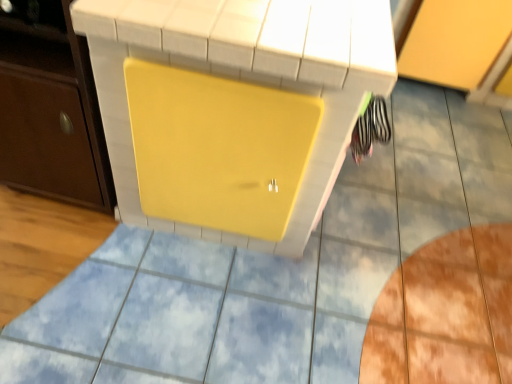
Locate an element on the screen. This screenshot has width=512, height=384. yellow matte cabinet at upper right, which ranks as the first cabinetry in back-to-front order is located at coordinates (455, 41).

Where is `yellow matte vanity at center`? Image resolution: width=512 pixels, height=384 pixels. yellow matte vanity at center is located at coordinates (260, 29).

Identify the location of matte brown cabinet at left, the first cabinetry when ordered from left to right. This screenshot has height=384, width=512. (50, 108).

Is yellow matte cabinet at upper right, placed as the first cabinetry when sorted from right to left, oriented towards matte brown cabinet at left, the first cabinetry when ordered from left to right?

No, yellow matte cabinet at upper right, placed as the first cabinetry when sorted from right to left, is not oriented towards matte brown cabinet at left, the first cabinetry when ordered from left to right.

From the picture: From a real-world perspective, between yellow matte cabinet at upper right, which is the 2th cabinetry in front-to-back order, and matte brown cabinet at left, marked as the second cabinetry in a right-to-left arrangement, who is vertically higher?

From a 3D spatial view, matte brown cabinet at left, marked as the second cabinetry in a right-to-left arrangement, is above.

From the image's perspective, between yellow matte cabinet at upper right, the second cabinetry from the left, and matte brown cabinet at left, the 1th cabinetry positioned from the front, who is located below?

From the image's view, matte brown cabinet at left, the 1th cabinetry positioned from the front, is below.

Could you tell me if matte brown cabinet at left, placed as the 2th cabinetry when sorted from back to front, is turned towards yellow matte vanity at center?

No, matte brown cabinet at left, placed as the 2th cabinetry when sorted from back to front, is not oriented towards yellow matte vanity at center.

Which object is further away from the camera, matte brown cabinet at left, marked as the second cabinetry in a right-to-left arrangement, or yellow matte vanity at center?

matte brown cabinet at left, marked as the second cabinetry in a right-to-left arrangement, is behind.

From a real-world perspective, is matte brown cabinet at left, the 1th cabinetry positioned from the front, positioned over yellow matte vanity at center based on gravity?

No.

Is yellow matte vanity at center wider or thinner than matte brown cabinet at left, the 1th cabinetry positioned from the front?

Considering their sizes, yellow matte vanity at center looks broader than matte brown cabinet at left, the 1th cabinetry positioned from the front.

Visually, is yellow matte vanity at center positioned to the left or to the right of matte brown cabinet at left, the first cabinetry when ordered from left to right?

Based on their positions, yellow matte vanity at center is located to the right of matte brown cabinet at left, the first cabinetry when ordered from left to right.

Considering the positions of objects yellow matte vanity at center and matte brown cabinet at left, placed as the 2th cabinetry when sorted from back to front, in the image provided, who is in front, yellow matte vanity at center or matte brown cabinet at left, placed as the 2th cabinetry when sorted from back to front,?

yellow matte vanity at center.

From a real-world perspective, is yellow matte vanity at center beneath matte brown cabinet at left, placed as the 2th cabinetry when sorted from back to front?

Actually, yellow matte vanity at center is physically above matte brown cabinet at left, placed as the 2th cabinetry when sorted from back to front, in the real world.

Is matte brown cabinet at left, the first cabinetry when ordered from left to right, surrounding yellow matte cabinet at upper right, the second cabinetry from the left?

No, yellow matte cabinet at upper right, the second cabinetry from the left, is not inside matte brown cabinet at left, the first cabinetry when ordered from left to right.

Which is nearer, (74, 187) or (433, 42)?

Clearly, point (74, 187) is closer to the camera than point (433, 42).

Considering the relative sizes of matte brown cabinet at left, the 1th cabinetry positioned from the front, and yellow matte cabinet at upper right, which is the 2th cabinetry in front-to-back order, in the image provided, is matte brown cabinet at left, the 1th cabinetry positioned from the front, wider than yellow matte cabinet at upper right, which is the 2th cabinetry in front-to-back order,?

Incorrect, the width of matte brown cabinet at left, the 1th cabinetry positioned from the front, does not surpass that of yellow matte cabinet at upper right, which is the 2th cabinetry in front-to-back order.

From a real-world perspective, between yellow matte cabinet at upper right, placed as the first cabinetry when sorted from right to left, and yellow matte vanity at center, who is vertically lower?

In real-world perspective, yellow matte cabinet at upper right, placed as the first cabinetry when sorted from right to left, is lower.

Is yellow matte cabinet at upper right, which is the 2th cabinetry in front-to-back order, positioned far away from yellow matte vanity at center?

Yes, yellow matte cabinet at upper right, which is the 2th cabinetry in front-to-back order, and yellow matte vanity at center are located far from each other.

Considering the sizes of yellow matte cabinet at upper right, the second cabinetry from the left, and yellow matte vanity at center in the image, is yellow matte cabinet at upper right, the second cabinetry from the left, taller or shorter than yellow matte vanity at center?

Considering their sizes, yellow matte cabinet at upper right, the second cabinetry from the left, has less height than yellow matte vanity at center.

Can you confirm if yellow matte cabinet at upper right, which is the 2th cabinetry in front-to-back order, is positioned to the left of yellow matte vanity at center?

No, yellow matte cabinet at upper right, which is the 2th cabinetry in front-to-back order, is not to the left of yellow matte vanity at center.

Which of these two, yellow matte vanity at center or yellow matte cabinet at upper right, which ranks as the first cabinetry in back-to-front order, stands taller?

With more height is yellow matte vanity at center.

Which cabinetry is the 2nd one when counting from the back of the yellow matte vanity at center? Please provide its 2D coordinates.

[(455, 41)]

Is yellow matte vanity at center wider or thinner than yellow matte cabinet at upper right, the second cabinetry from the left?

Considering their sizes, yellow matte vanity at center looks slimmer than yellow matte cabinet at upper right, the second cabinetry from the left.

Relative to yellow matte cabinet at upper right, which ranks as the first cabinetry in back-to-front order, is yellow matte vanity at center in front or behind?

Clearly, yellow matte vanity at center is in front of yellow matte cabinet at upper right, which ranks as the first cabinetry in back-to-front order.

The width and height of the screenshot is (512, 384). What are the coordinates of `cabinetry lying behind the matte brown cabinet at left, marked as the second cabinetry in a right-to-left arrangement` in the screenshot? It's located at (455, 41).

The width and height of the screenshot is (512, 384). In the image, there is a matte brown cabinet at left, the first cabinetry when ordered from left to right. Identify the location of vanity above it (from the image's perspective). (260, 29).

Consider the image. Which object lies nearer to the anchor point yellow matte cabinet at upper right, which ranks as the first cabinetry in back-to-front order, matte brown cabinet at left, the 1th cabinetry positioned from the front, or yellow matte vanity at center?

yellow matte vanity at center is positioned closer to the anchor yellow matte cabinet at upper right, which ranks as the first cabinetry in back-to-front order.

Which object lies nearer to the anchor point yellow matte cabinet at upper right, placed as the first cabinetry when sorted from right to left, yellow matte vanity at center or matte brown cabinet at left, the 1th cabinetry positioned from the front?

The object closer to yellow matte cabinet at upper right, placed as the first cabinetry when sorted from right to left, is yellow matte vanity at center.

Looking at the image, which one is located closer to matte brown cabinet at left, the 1th cabinetry positioned from the front, yellow matte vanity at center or yellow matte cabinet at upper right, which is the 2th cabinetry in front-to-back order?

Based on the image, yellow matte vanity at center appears to be nearer to matte brown cabinet at left, the 1th cabinetry positioned from the front.

Which object lies nearer to the anchor point matte brown cabinet at left, placed as the 2th cabinetry when sorted from back to front, yellow matte cabinet at upper right, which is the 2th cabinetry in front-to-back order, or yellow matte vanity at center?

yellow matte vanity at center is positioned closer to the anchor matte brown cabinet at left, placed as the 2th cabinetry when sorted from back to front.

Considering their positions, is yellow matte cabinet at upper right, which ranks as the first cabinetry in back-to-front order, positioned further to yellow matte vanity at center than matte brown cabinet at left, the first cabinetry when ordered from left to right?

yellow matte cabinet at upper right, which ranks as the first cabinetry in back-to-front order, lies further to yellow matte vanity at center than the other object.

From the picture: Based on their spatial positions, is matte brown cabinet at left, placed as the 2th cabinetry when sorted from back to front, or yellow matte cabinet at upper right, which is the 2th cabinetry in front-to-back order, closer to yellow matte vanity at center?

matte brown cabinet at left, placed as the 2th cabinetry when sorted from back to front.

Where is `vanity located between matte brown cabinet at left, the 1th cabinetry positioned from the front, and yellow matte cabinet at upper right, which is the 2th cabinetry in front-to-back order, in the left-right direction`? vanity located between matte brown cabinet at left, the 1th cabinetry positioned from the front, and yellow matte cabinet at upper right, which is the 2th cabinetry in front-to-back order, in the left-right direction is located at coordinates (260, 29).